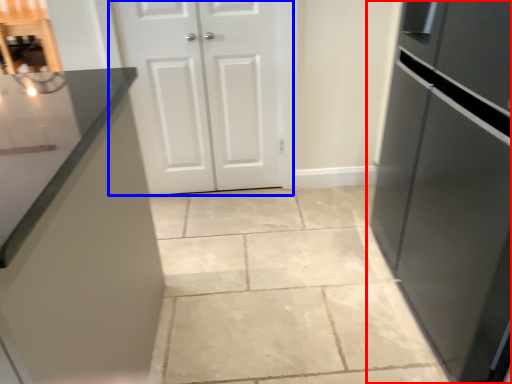
Question: Which point is further to the camera, refrigerator (highlighted by a red box) or door (highlighted by a blue box)?

Choices:
 (A) refrigerator
 (B) door

Answer: (B)